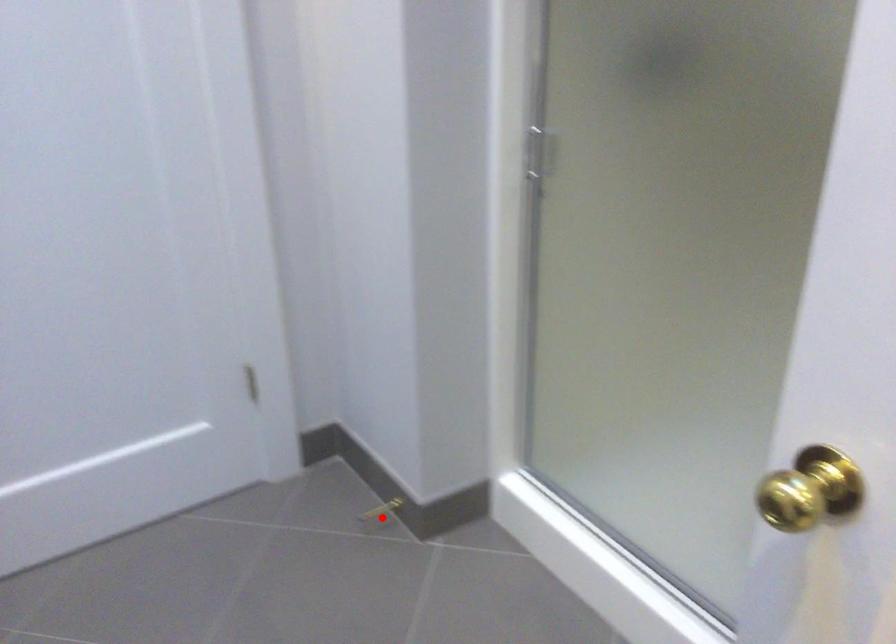
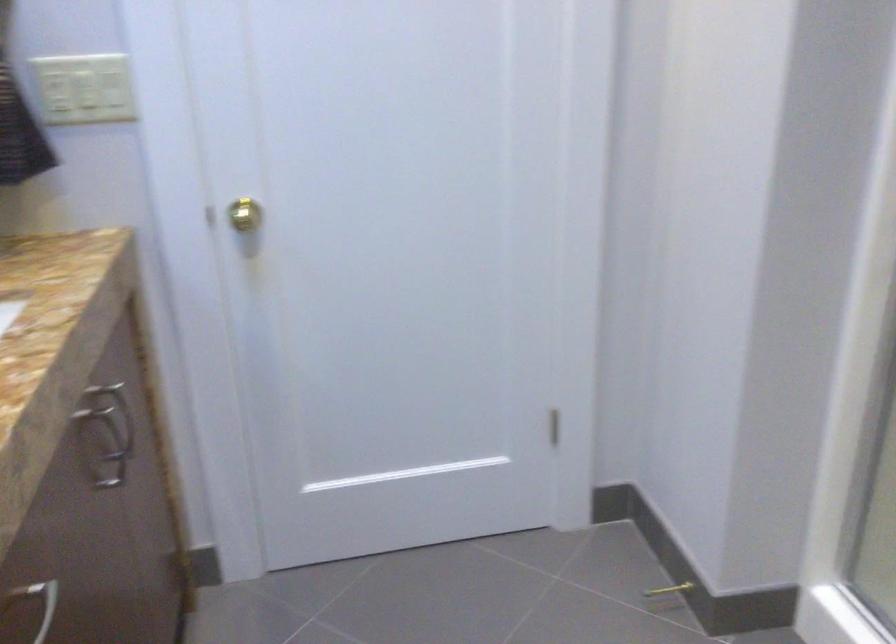
Where in the second image is the point corresponding to the highlighted location from the first image?

(666, 596)